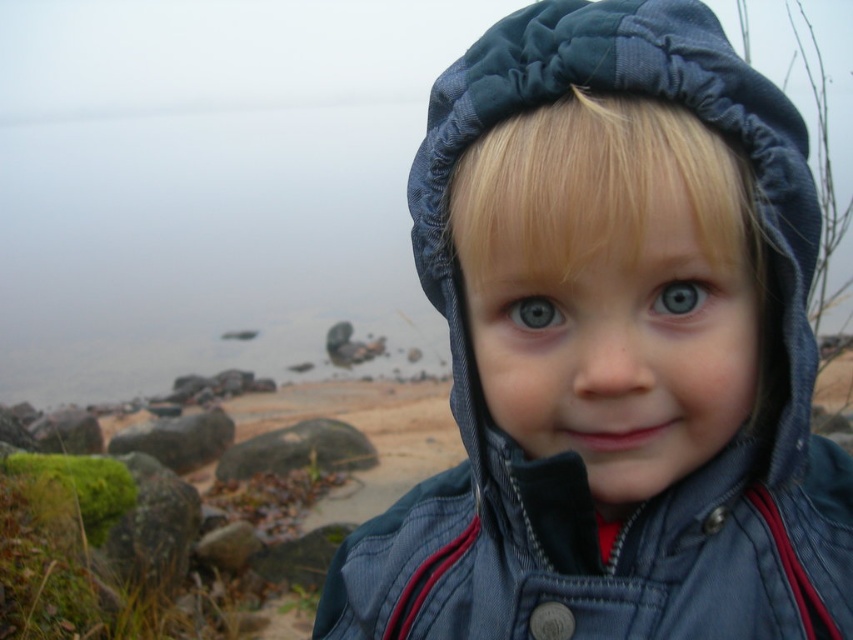
The child in the image is wearing a denim jacket at center and has a blue glossy eye at center. Which object is larger in size?

The denim jacket at center is bigger than the blue glossy eye at center.